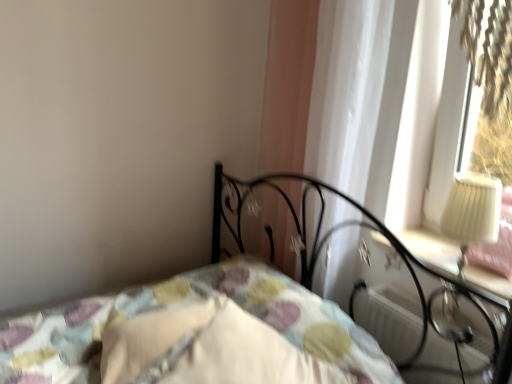
Question: Considering the relative sizes of white plastic radiator at lower right and white soft pillow at lower center, which is counted as the 1th pillow, starting from the left, in the image provided, is white plastic radiator at lower right taller than white soft pillow at lower center, which is counted as the 1th pillow, starting from the left,?

Choices:
 (A) yes
 (B) no

Answer: (A)

Question: From the image's perspective, is white plastic radiator at lower right over white soft pillow at lower center, the 2th pillow in the right-to-left sequence?

Choices:
 (A) yes
 (B) no

Answer: (B)

Question: Is white soft pillow at lower center, the 2th pillow in the right-to-left sequence, inside white plastic radiator at lower right?

Choices:
 (A) no
 (B) yes

Answer: (A)

Question: Considering the relative sizes of white plastic radiator at lower right and white soft pillow at lower center, which is counted as the 1th pillow, starting from the left, in the image provided, is white plastic radiator at lower right wider than white soft pillow at lower center, which is counted as the 1th pillow, starting from the left,?

Choices:
 (A) yes
 (B) no

Answer: (B)

Question: From the image's perspective, would you say white plastic radiator at lower right is shown under white soft pillow at lower center, which is counted as the 1th pillow, starting from the left?

Choices:
 (A) no
 (B) yes

Answer: (B)

Question: Is the depth of white plastic radiator at lower right greater than that of white soft pillow at lower center, the 2th pillow in the right-to-left sequence?

Choices:
 (A) yes
 (B) no

Answer: (A)

Question: Considering the relative positions of white soft pillow at lower center, which is counted as the 1th pillow, starting from the left, and white sheer curtain at upper right in the image provided, is white soft pillow at lower center, which is counted as the 1th pillow, starting from the left, to the right of white sheer curtain at upper right from the viewer's perspective?

Choices:
 (A) no
 (B) yes

Answer: (A)

Question: Is the position of white soft pillow at lower center, which is counted as the 1th pillow, starting from the left, more distant than that of white sheer curtain at upper right?

Choices:
 (A) no
 (B) yes

Answer: (A)

Question: Is white soft pillow at lower center, the 2th pillow in the right-to-left sequence, not close to white sheer curtain at upper right?

Choices:
 (A) no
 (B) yes

Answer: (A)

Question: Is white soft pillow at lower center, the 2th pillow in the right-to-left sequence, at the left side of white sheer curtain at upper right?

Choices:
 (A) no
 (B) yes

Answer: (B)

Question: Is white soft pillow at lower center, which is counted as the 1th pillow, starting from the left, next to white sheer curtain at upper right?

Choices:
 (A) yes
 (B) no

Answer: (B)

Question: Does white soft pillow at lower center, which is counted as the 1th pillow, starting from the left, have a lesser height compared to white sheer curtain at upper right?

Choices:
 (A) yes
 (B) no

Answer: (A)

Question: From the image's perspective, is white plastic radiator at lower right over white soft pillow at center, the first pillow when ordered from right to left?

Choices:
 (A) no
 (B) yes

Answer: (A)